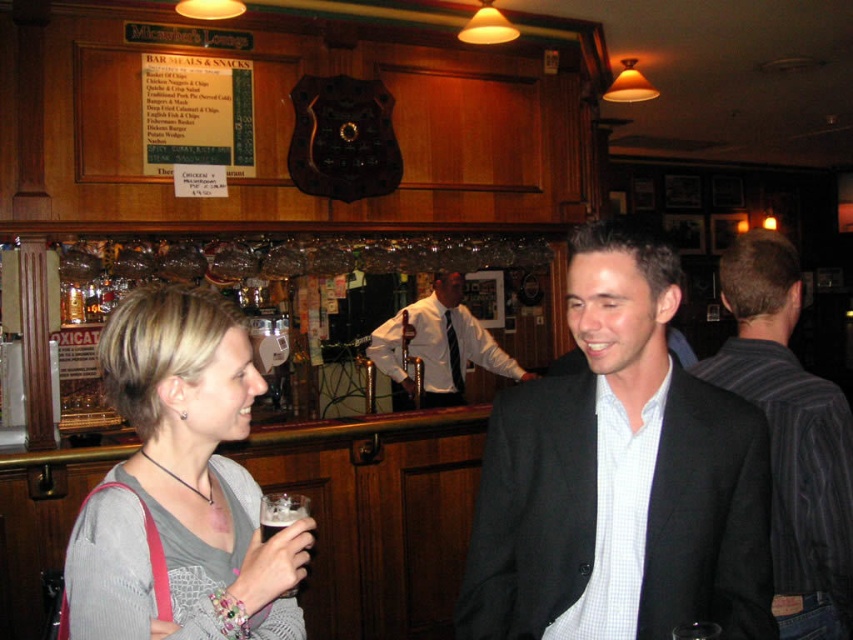
Can you confirm if gray sweater at center is wider than striped fabric shirt at right?

No, gray sweater at center is not wider than striped fabric shirt at right.

Is point (126, 484) less distant than point (759, 262)?

Yes, it is.

Identify the location of gray sweater at center. [181, 484].

Can you confirm if gray knit sweater at center is positioned to the left of brown frothy beer at lower left?

No, gray knit sweater at center is not to the left of brown frothy beer at lower left.

Who is positioned more to the right, gray knit sweater at center or brown frothy beer at lower left?

gray knit sweater at center is more to the right.

Who is more forward, (759, 516) or (267, 529)?

Point (267, 529) is more forward.

I want to click on gray knit sweater at center, so click(x=625, y=476).

Who is lower down, white shirt at center or brown frothy beer at lower left?

brown frothy beer at lower left

Can you confirm if white shirt at center is bigger than brown frothy beer at lower left?

Indeed, white shirt at center has a larger size compared to brown frothy beer at lower left.

Is point (436, 336) farther from camera compared to point (293, 508)?

Yes, point (436, 336) is behind point (293, 508).

Where is `white shirt at center`? white shirt at center is located at coordinates (437, 348).